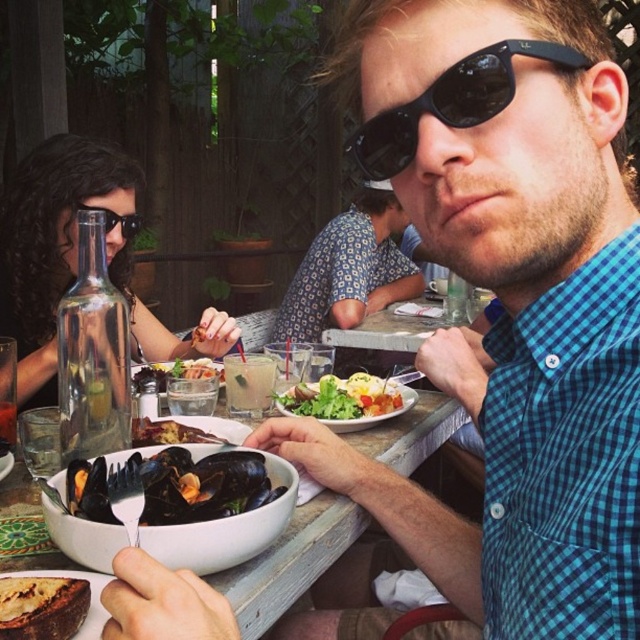
Does black plastic sunglasses at upper center have a lesser width compared to shiny dark mussels at center?

No.

From the picture: Does black plastic sunglasses at upper center appear under shiny dark mussels at center?

→ No.

Where is `black plastic sunglasses at upper center`? black plastic sunglasses at upper center is located at coordinates (452, 102).

Is point (364, 256) closer to camera compared to point (106, 230)?

No, it is behind (106, 230).

Is floral-patterned shirt at center further to the viewer compared to matte black goggles at upper left?

Yes, it is behind matte black goggles at upper left.

Where is `floral-patterned shirt at center`? The height and width of the screenshot is (640, 640). floral-patterned shirt at center is located at coordinates (349, 269).

Measure the distance between point (224, 348) and camera.

They are 4.50 feet apart.

Does point (65, 202) lie in front of point (1, 636)?

No, (65, 202) is behind (1, 636).

I want to click on matte black sunglasses at upper left, so click(x=51, y=243).